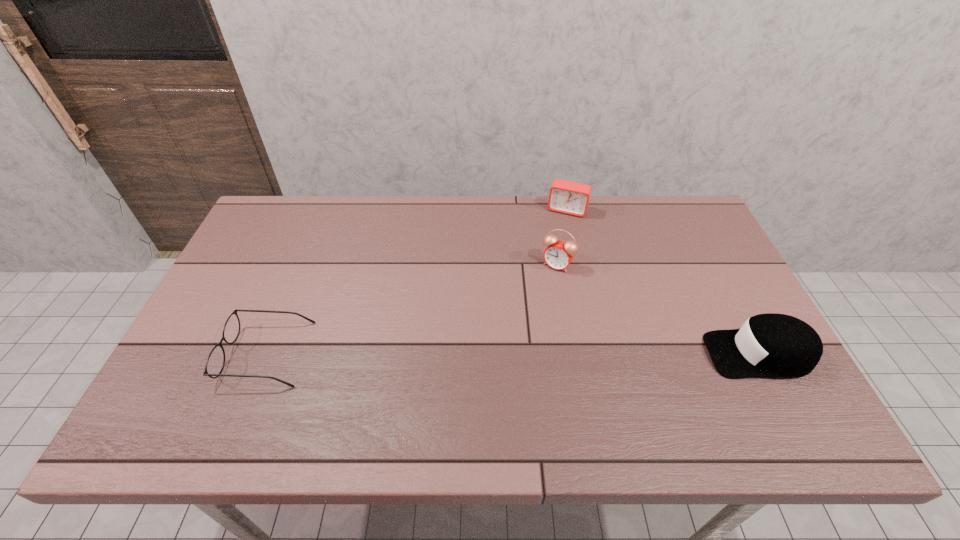
Find the location of a particular element. This screenshot has width=960, height=540. the leftmost object is located at coordinates (215, 363).

This screenshot has height=540, width=960. I want to click on the shortest object, so click(215, 363).

Where is `cap`? This screenshot has height=540, width=960. cap is located at coordinates (777, 345).

This screenshot has width=960, height=540. Identify the location of the tallest object. (558, 255).

You are a GUI agent. You are given a task and a screenshot of the screen. Output one action in this format:
    pyautogui.click(x=<x>, y=<y>)
    Task: Click on the nearer alarm clock
    
    Given the screenshot: What is the action you would take?
    pyautogui.click(x=558, y=255)

Image resolution: width=960 pixels, height=540 pixels. In order to click on the farther alarm clock in this screenshot , I will do `click(567, 197)`.

Locate an element on the screen. The height and width of the screenshot is (540, 960). the shorter alarm clock is located at coordinates pyautogui.click(x=567, y=197).

Where is `vacant space located on the front-facing side of the leftmost object`? Image resolution: width=960 pixels, height=540 pixels. vacant space located on the front-facing side of the leftmost object is located at coordinates (192, 353).

Locate an element on the screen. vacant region located on the front-facing side of the leftmost object is located at coordinates coord(188,353).

The width and height of the screenshot is (960, 540). Find the location of `free point located 0.330m on the front-facing side of the rightmost object`. free point located 0.330m on the front-facing side of the rightmost object is located at coordinates (573, 354).